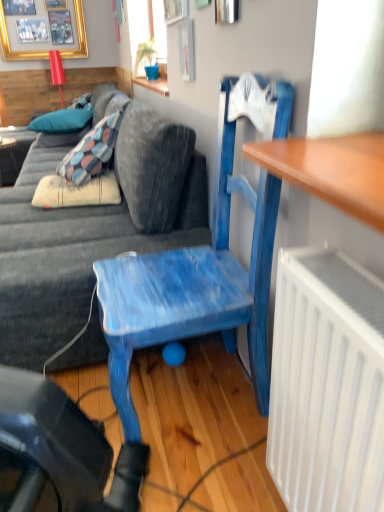
Question: Is blue fabric pillow at upper left, the first pillow from the bottom, further to camera compared to gold framed picture at upper left?

Choices:
 (A) yes
 (B) no

Answer: (B)

Question: Can you confirm if blue fabric pillow at upper left, the first pillow from the bottom, is smaller than gold framed picture at upper left?

Choices:
 (A) yes
 (B) no

Answer: (B)

Question: Considering the relative sizes of blue fabric pillow at upper left, which ranks as the second pillow in top-to-bottom order, and gold framed picture at upper left in the image provided, is blue fabric pillow at upper left, which ranks as the second pillow in top-to-bottom order, taller than gold framed picture at upper left?

Choices:
 (A) yes
 (B) no

Answer: (B)

Question: Can you confirm if blue fabric pillow at upper left, the first pillow from the bottom, is thinner than gold framed picture at upper left?

Choices:
 (A) yes
 (B) no

Answer: (B)

Question: Is blue fabric pillow at upper left, which ranks as the second pillow in top-to-bottom order, shorter than gold framed picture at upper left?

Choices:
 (A) no
 (B) yes

Answer: (B)

Question: Is matte black desk at left wider or thinner than gold framed picture at upper left?

Choices:
 (A) wide
 (B) thin

Answer: (A)

Question: Relative to gold framed picture at upper left, is matte black desk at left in front or behind?

Choices:
 (A) behind
 (B) front

Answer: (B)

Question: From the image's perspective, is matte black desk at left positioned above or below gold framed picture at upper left?

Choices:
 (A) above
 (B) below

Answer: (B)

Question: From their relative heights in the image, would you say matte black desk at left is taller or shorter than gold framed picture at upper left?

Choices:
 (A) tall
 (B) short

Answer: (B)

Question: From a real-world perspective, is blue fabric pillow at upper left, which ranks as the second pillow in top-to-bottom order, positioned above or below gold framed picture at upper left?

Choices:
 (A) above
 (B) below

Answer: (B)

Question: In terms of height, does blue fabric pillow at upper left, which ranks as the second pillow in top-to-bottom order, look taller or shorter compared to gold framed picture at upper left?

Choices:
 (A) tall
 (B) short

Answer: (B)

Question: In the image, is blue fabric pillow at upper left, the first pillow from the bottom, positioned in front of or behind gold framed picture at upper left?

Choices:
 (A) front
 (B) behind

Answer: (A)

Question: Is blue fabric pillow at upper left, which ranks as the second pillow in top-to-bottom order, situated inside gold framed picture at upper left or outside?

Choices:
 (A) inside
 (B) outside

Answer: (B)

Question: In the image, is blue fabric pillow at upper left, which is counted as the second pillow, starting from the bottom, positioned in front of or behind matte black desk at left?

Choices:
 (A) front
 (B) behind

Answer: (B)

Question: From a real-world perspective, relative to matte black desk at left, is blue fabric pillow at upper left, which is counted as the second pillow, starting from the bottom, vertically above or below?

Choices:
 (A) below
 (B) above

Answer: (B)